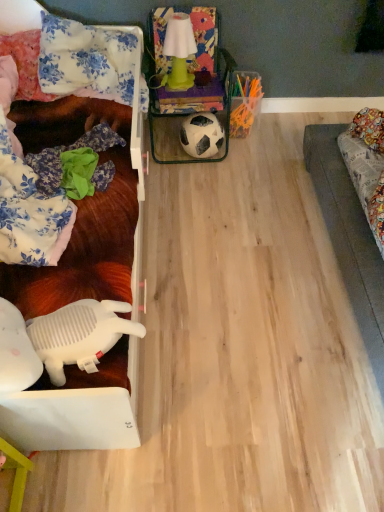
Question: Is floral fabric pillow at upper left, the 2th pillow from the left, to the left of white matte football at center from the viewer's perspective?

Choices:
 (A) yes
 (B) no

Answer: (A)

Question: From a real-world perspective, does floral fabric pillow at upper left, acting as the first pillow starting from the right, sit lower than white matte football at center?

Choices:
 (A) yes
 (B) no

Answer: (B)

Question: Does floral fabric pillow at upper left, acting as the first pillow starting from the right, have a lesser height compared to white matte football at center?

Choices:
 (A) yes
 (B) no

Answer: (B)

Question: From a real-world perspective, is floral fabric pillow at upper left, the 2th pillow from the left, on white matte football at center?

Choices:
 (A) yes
 (B) no

Answer: (A)

Question: Is the depth of floral fabric pillow at upper left, the 2th pillow from the left, less than that of white matte football at center?

Choices:
 (A) yes
 (B) no

Answer: (A)

Question: Which is correct: floral fabric pillow at upper left, the 2th pillow from the left, is inside white plastic toy at lower left, or outside of it?

Choices:
 (A) outside
 (B) inside

Answer: (A)

Question: Considering their positions, is floral fabric pillow at upper left, acting as the first pillow starting from the right, located in front of or behind white plastic toy at lower left?

Choices:
 (A) behind
 (B) front

Answer: (A)

Question: From the image's perspective, is floral fabric pillow at upper left, the 2th pillow from the left, positioned above or below white plastic toy at lower left?

Choices:
 (A) above
 (B) below

Answer: (A)

Question: From a real-world perspective, is floral fabric pillow at upper left, the 2th pillow from the left, positioned above or below white plastic toy at lower left?

Choices:
 (A) below
 (B) above

Answer: (B)

Question: In terms of width, does white plastic toy at left look wider or thinner when compared to white plastic toy at lower left?

Choices:
 (A) thin
 (B) wide

Answer: (B)

Question: Based on their sizes in the image, would you say white plastic toy at left is bigger or smaller than white plastic toy at lower left?

Choices:
 (A) big
 (B) small

Answer: (A)

Question: From their relative heights in the image, would you say white plastic toy at left is taller or shorter than white plastic toy at lower left?

Choices:
 (A) tall
 (B) short

Answer: (A)

Question: Does point click(x=57, y=449) appear closer or farther from the camera than point click(x=31, y=323)?

Choices:
 (A) farther
 (B) closer

Answer: (A)

Question: Is point (13, 57) closer or farther from the camera than point (41, 70)?

Choices:
 (A) farther
 (B) closer

Answer: (A)

Question: From the image's perspective, is floral fabric pillow at upper left, positioned as the first pillow in left-to-right order, located above or below floral fabric pillow at upper left, acting as the first pillow starting from the right?

Choices:
 (A) above
 (B) below

Answer: (B)